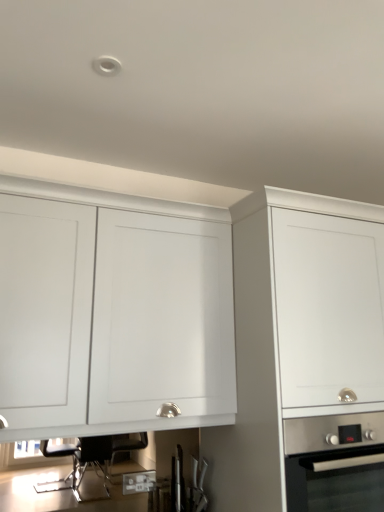
Where is `stainless steel oven at lower right`? stainless steel oven at lower right is located at coordinates (334, 464).

Is white matte cabinet at center, which ranks as the 1th cabinetry in right-to-left order, placed right next to white matte cabinet at upper left, the first cabinetry viewed from the left?

No, white matte cabinet at center, which ranks as the 1th cabinetry in right-to-left order, is not beside white matte cabinet at upper left, the first cabinetry viewed from the left.

Is white matte cabinet at center, which ranks as the 1th cabinetry in right-to-left order, facing towards white matte cabinet at upper left, the first cabinetry viewed from the left?

No, white matte cabinet at center, which ranks as the 1th cabinetry in right-to-left order, is not turned towards white matte cabinet at upper left, the first cabinetry viewed from the left.

Is white matte cabinet at center, positioned as the 2th cabinetry in left-to-right order, outside of white matte cabinet at upper left, which ranks as the 2th cabinetry in right-to-left order?

white matte cabinet at center, positioned as the 2th cabinetry in left-to-right order, lies outside white matte cabinet at upper left, which ranks as the 2th cabinetry in right-to-left order,'s area.

From the image's perspective, is white matte cabinet at center, positioned as the 2th cabinetry in left-to-right order, on top of white matte cabinet at upper left, which ranks as the 2th cabinetry in right-to-left order?

Actually, white matte cabinet at center, positioned as the 2th cabinetry in left-to-right order, appears below white matte cabinet at upper left, which ranks as the 2th cabinetry in right-to-left order, in the image.

Is point (364, 468) closer to camera compared to point (259, 309)?

Yes, it is in front of point (259, 309).

Who is smaller, stainless steel oven at lower right or white matte cabinet at center, which ranks as the 1th cabinetry in right-to-left order?

stainless steel oven at lower right.

In the scene shown: Between stainless steel oven at lower right and white matte cabinet at center, positioned as the 2th cabinetry in left-to-right order, which one is positioned in front?

white matte cabinet at center, positioned as the 2th cabinetry in left-to-right order, is more forward.

Is white matte cabinet at upper left, which ranks as the 2th cabinetry in right-to-left order, oriented towards stainless steel oven at lower right?

No, white matte cabinet at upper left, which ranks as the 2th cabinetry in right-to-left order, does not turn towards stainless steel oven at lower right.

Based on their positions, is white matte cabinet at upper left, which ranks as the 2th cabinetry in right-to-left order, located to the left or right of stainless steel oven at lower right?

In the image, white matte cabinet at upper left, which ranks as the 2th cabinetry in right-to-left order, appears on the left side of stainless steel oven at lower right.

From a real-world perspective, is white matte cabinet at upper left, the first cabinetry viewed from the left, positioned above or below stainless steel oven at lower right?

white matte cabinet at upper left, the first cabinetry viewed from the left, is situated higher than stainless steel oven at lower right in the real world.

From the picture: From the image's perspective, which object appears higher, white matte cabinet at upper left, the first cabinetry viewed from the left, or stainless steel oven at lower right?

white matte cabinet at upper left, the first cabinetry viewed from the left, is shown above in the image.

Is stainless steel oven at lower right placed right next to white matte cabinet at upper left, which ranks as the 2th cabinetry in right-to-left order?

There is a gap between stainless steel oven at lower right and white matte cabinet at upper left, which ranks as the 2th cabinetry in right-to-left order.

From a real-world perspective, which object rests below the other?

From a 3D spatial view, stainless steel oven at lower right is below.

Which is less distant, (372, 426) or (160, 374)?

Point (372, 426) is farther from the camera than point (160, 374).

Can you confirm if white matte cabinet at center, positioned as the 2th cabinetry in left-to-right order, is shorter than stainless steel oven at lower right?

Incorrect, the height of white matte cabinet at center, positioned as the 2th cabinetry in left-to-right order, does not fall short of that of stainless steel oven at lower right.

From a real-world perspective, who is located higher, white matte cabinet at center, which ranks as the 1th cabinetry in right-to-left order, or stainless steel oven at lower right?

white matte cabinet at center, which ranks as the 1th cabinetry in right-to-left order, from a real-world perspective.

Which is in front, white matte cabinet at center, which ranks as the 1th cabinetry in right-to-left order, or stainless steel oven at lower right?

white matte cabinet at center, which ranks as the 1th cabinetry in right-to-left order, is closer to the camera.

Considering the relative sizes of white matte cabinet at center, which ranks as the 1th cabinetry in right-to-left order, and stainless steel oven at lower right in the image provided, is white matte cabinet at center, which ranks as the 1th cabinetry in right-to-left order, bigger than stainless steel oven at lower right?

Correct, white matte cabinet at center, which ranks as the 1th cabinetry in right-to-left order, is larger in size than stainless steel oven at lower right.

From a real-world perspective, which object stands above the other?

white matte cabinet at upper left, which ranks as the 2th cabinetry in right-to-left order.

Which of these two, white matte cabinet at upper left, which ranks as the 2th cabinetry in right-to-left order, or white matte cabinet at center, which ranks as the 1th cabinetry in right-to-left order, is thinner?

white matte cabinet at upper left, which ranks as the 2th cabinetry in right-to-left order.

Is white matte cabinet at upper left, the first cabinetry viewed from the left, directly adjacent to white matte cabinet at center, which ranks as the 1th cabinetry in right-to-left order?

No, white matte cabinet at upper left, the first cabinetry viewed from the left, is not next to white matte cabinet at center, which ranks as the 1th cabinetry in right-to-left order.

Identify the location of cabinetry above the white matte cabinet at center, which ranks as the 1th cabinetry in right-to-left order (from the image's perspective). This screenshot has width=384, height=512. (114, 314).

From a real-world perspective, count 1st cabinetrys upward from the stainless steel oven at lower right and point to it. Please provide its 2D coordinates.

[(259, 356)]

When comparing their distances from white matte cabinet at upper left, which ranks as the 2th cabinetry in right-to-left order, does white matte cabinet at center, positioned as the 2th cabinetry in left-to-right order, or stainless steel oven at lower right seem closer?

Based on the image, white matte cabinet at center, positioned as the 2th cabinetry in left-to-right order, appears to be nearer to white matte cabinet at upper left, which ranks as the 2th cabinetry in right-to-left order.

Estimate the real-world distances between objects in this image. Which object is closer to stainless steel oven at lower right, white matte cabinet at upper left, the first cabinetry viewed from the left, or white matte cabinet at center, which ranks as the 1th cabinetry in right-to-left order?

white matte cabinet at center, which ranks as the 1th cabinetry in right-to-left order, is positioned closer to the anchor stainless steel oven at lower right.

Estimate the real-world distances between objects in this image. Which object is closer to white matte cabinet at upper left, which ranks as the 2th cabinetry in right-to-left order, stainless steel oven at lower right or white matte cabinet at center, which ranks as the 1th cabinetry in right-to-left order?

white matte cabinet at center, which ranks as the 1th cabinetry in right-to-left order, is closer to white matte cabinet at upper left, which ranks as the 2th cabinetry in right-to-left order.

Considering their positions, is stainless steel oven at lower right positioned further to white matte cabinet at center, which ranks as the 1th cabinetry in right-to-left order, than white matte cabinet at upper left, which ranks as the 2th cabinetry in right-to-left order?

white matte cabinet at upper left, which ranks as the 2th cabinetry in right-to-left order, is further to white matte cabinet at center, which ranks as the 1th cabinetry in right-to-left order.

Based on their spatial positions, is white matte cabinet at upper left, which ranks as the 2th cabinetry in right-to-left order, or stainless steel oven at lower right closer to white matte cabinet at center, positioned as the 2th cabinetry in left-to-right order?

The object closer to white matte cabinet at center, positioned as the 2th cabinetry in left-to-right order, is stainless steel oven at lower right.

Considering their positions, is white matte cabinet at center, positioned as the 2th cabinetry in left-to-right order, positioned further to stainless steel oven at lower right than white matte cabinet at upper left, which ranks as the 2th cabinetry in right-to-left order?

Among the two, white matte cabinet at upper left, which ranks as the 2th cabinetry in right-to-left order, is located further to stainless steel oven at lower right.

Locate an element on the screen. home appliance between white matte cabinet at upper left, the first cabinetry viewed from the left, and white matte cabinet at center, positioned as the 2th cabinetry in left-to-right order, from left to right is located at coordinates (334, 464).